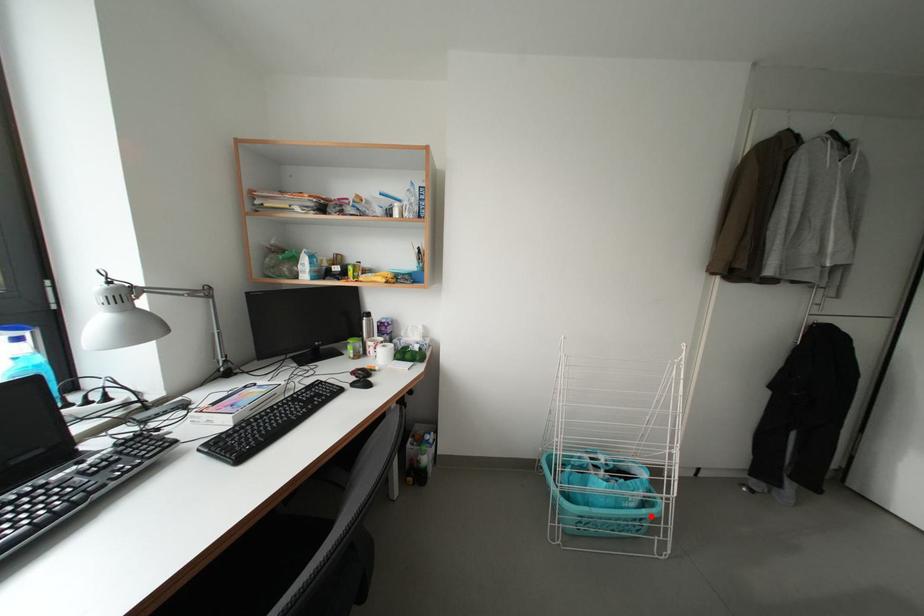
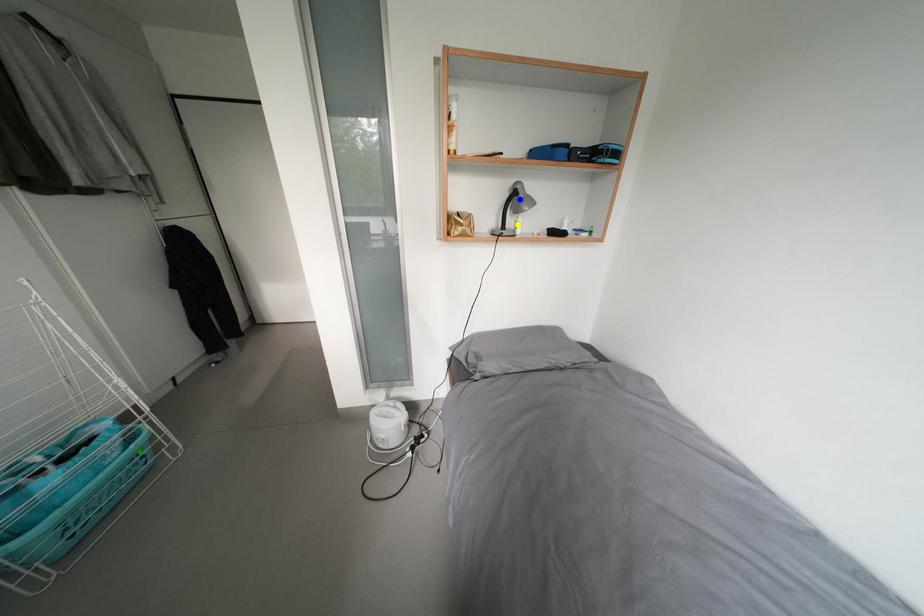
Question: I am providing you with two images of the same scene from different viewpoints. A red point is marked on the first image. You are given multiple points on the second image. Which point in image 2 is actually the same real-world point as the red point in image 1?

Choices:
 (A) green point
 (B) blue point
 (C) yellow point

Answer: (A)